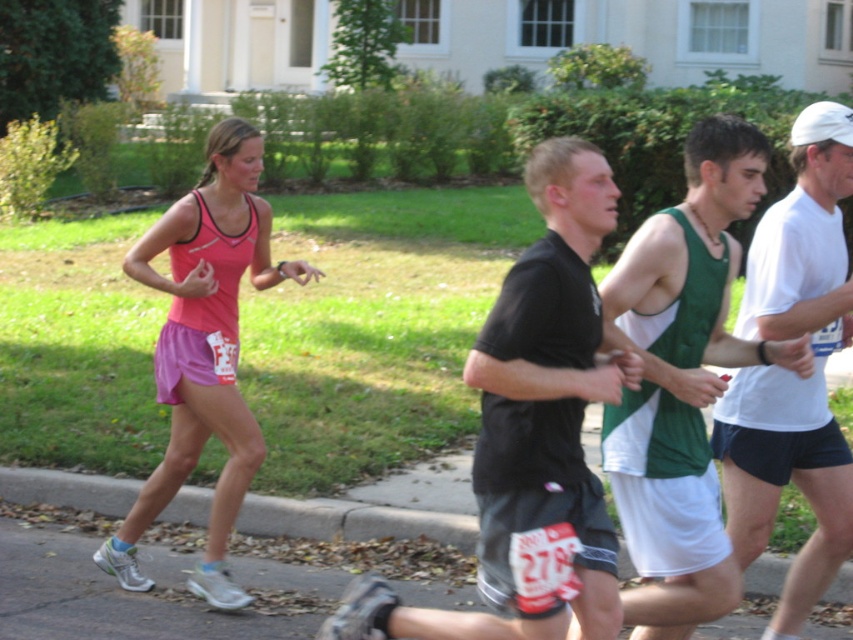
Question: Which point is farther to the camera?

Choices:
 (A) (561, 284)
 (B) (834, 173)

Answer: (B)

Question: Which point appears farthest from the camera in this image?

Choices:
 (A) (669, 429)
 (B) (244, 195)
 (C) (372, 515)

Answer: (C)

Question: Which of these objects is positioned farthest from the pink fabric tank top at left?

Choices:
 (A) black matte shirt at center
 (B) white matte shorts at right

Answer: (B)

Question: Can you confirm if black matte shirt at center is positioned above gray asphalt road at lower center?

Choices:
 (A) yes
 (B) no

Answer: (A)

Question: Is white matte shorts at right to the right of pink fabric tank top at left from the viewer's perspective?

Choices:
 (A) yes
 (B) no

Answer: (A)

Question: Can you confirm if white matte shorts at right is wider than gray asphalt road at lower center?

Choices:
 (A) yes
 (B) no

Answer: (B)